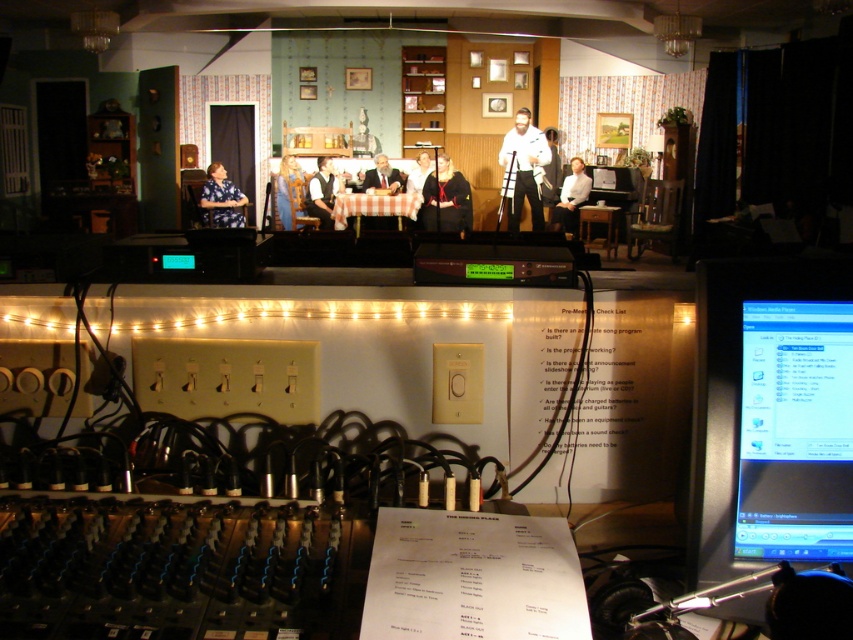
You are an actor standing on the stage and need to move to the wooden table at center. Based on the coordinates provided, can you determine the direction you should walk from your current position at point (599,227) to reach the wooden table at center?

The coordinates provided indicate that point (599,227) is already the location of the wooden table at center, so you are already at the wooden table at center and do not need to move.

You are a stagehand who needs to place a large prop trunk that measures 1.2 meters in length. The trunk must be positioned so that it doesn not block the checkered fabric table at center. Where should you place the trunk to ensure it is at least 1 meter away from the table?

Place the trunk at coordinates outside the area around the checkered fabric table at center, ensuring it is at least 1 meter away from the table located at point (x=374, y=205).

You are an actor standing at the stage entrance and need to locate the wooden table at center. According to the coordinates provided, where should you look to find it?

The wooden table at center is located at coordinates point (599,227).